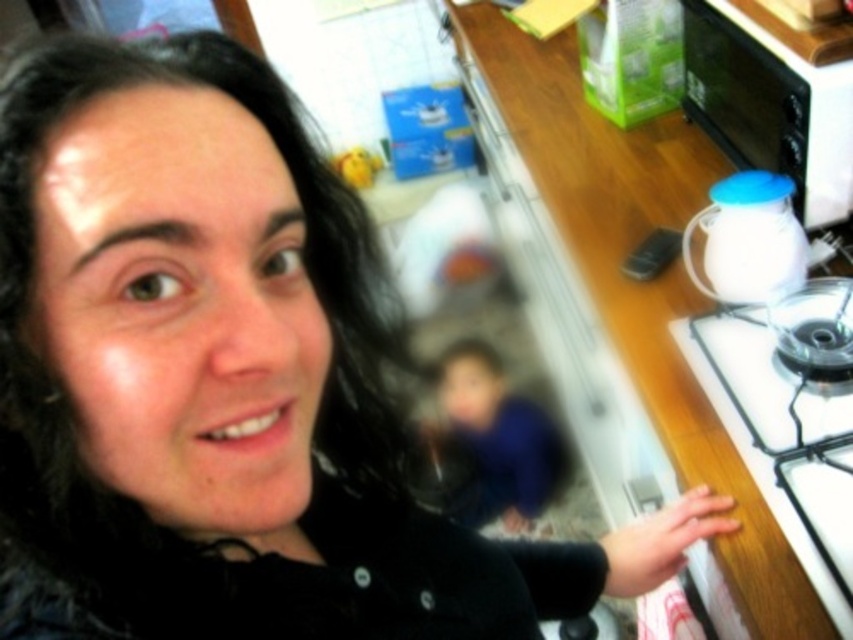
What is the object located at the coordinates point (639, 282) in the image?

The object located at point (639, 282) is the wooden countertop.

You are a chef preparing to move a large pot from the blue fabric at center to the white glossy oven at upper right. Considering their sizes, will the pot fit inside the oven?

The white glossy oven at upper right has a smaller size compared to blue fabric at center. Therefore, the pot that fits on the blue fabric at center may not fit inside the white glossy oven at upper right due to its smaller size.

You are a chef preparing to move a large pot from the white glossy gas stove at right to the white glossy oven at upper right. Considering their sizes, will the pot fit inside the oven?

The white glossy gas stove at right is smaller than the white glossy oven at upper right, so the pot that fits on the stove should fit inside the oven since the oven is larger.